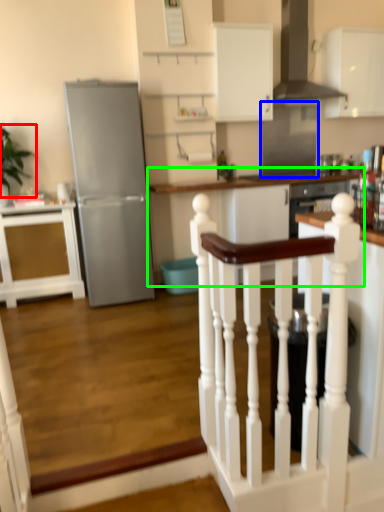
Question: Considering the real-world distances, which object is farthest from plant (highlighted by a red box)? glass door (highlighted by a blue box) or table (highlighted by a green box)?

Choices:
 (A) glass door
 (B) table

Answer: (A)